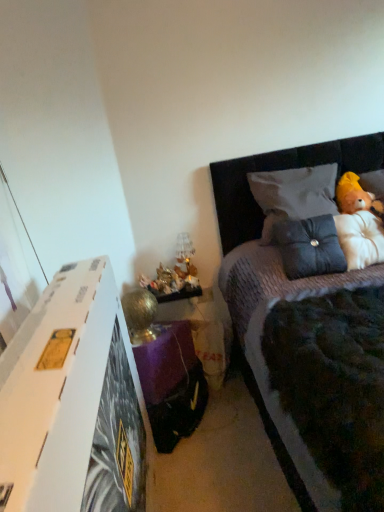
Question: In terms of size, does dark gray textured pillow at upper right, which is counted as the 1th pillow, starting from the top, appear bigger or smaller than fluffy white teddy bear at upper right?

Choices:
 (A) small
 (B) big

Answer: (A)

Question: Is dark gray textured pillow at upper right, which is counted as the 2th pillow, starting from the bottom, inside or outside of fluffy white teddy bear at upper right?

Choices:
 (A) outside
 (B) inside

Answer: (A)

Question: Which is farther from the dark gray textured pillow at upper right, which is counted as the 2th pillow, starting from the bottom?

Choices:
 (A) white cardboard at left
 (B) suede-like black pillow at upper right, which ranks as the second pillow in top-to-bottom order
 (C) fluffy white teddy bear at upper right
 (D) translucent glass lamp at lower center
 (E) velvet grey bed at upper right

Answer: (A)

Question: Which is nearer to the dark gray textured pillow at upper right, which is counted as the 2th pillow, starting from the bottom?

Choices:
 (A) fluffy white teddy bear at upper right
 (B) white cardboard at left
 (C) suede-like black pillow at upper right, positioned as the 1th pillow in bottom-to-top order
 (D) translucent glass lamp at lower center
 (E) velvet grey bed at upper right

Answer: (E)